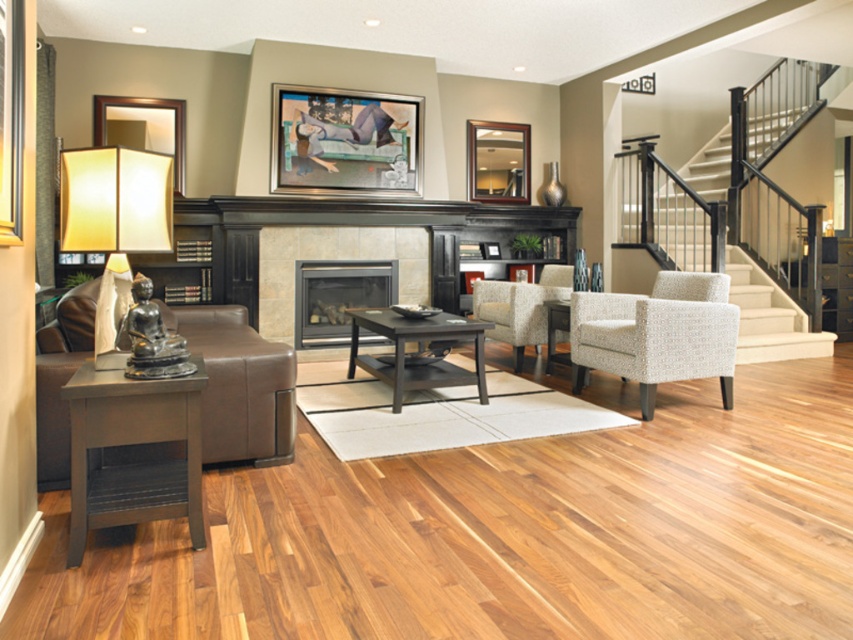
You are planning to place a new decorative item in the living room. The item you have is larger than the matte yellow fabric lampshade at left but smaller than the white textured stair at upper right. Where in the room would be a suitable location for this new item?

The new item should be placed near the matte yellow fabric lampshade at left since it is smaller than the white textured stair at upper right, ensuring it fits appropriately in the space.

You are arranging a shelf in the living room and need to place both the metallic silver picture frame at upper center and the wooden mirror at upper center. Since you want them side by side without overlapping, which object should you place first to ensure they fit properly?

The metallic silver picture frame at upper center should be placed first because its width is greater than the wooden mirror at upper center, ensuring there is enough space for both when placed side by side.

You are arranging a shelf in the living room and want to place both the metallic silver picture frame at upper center and the wooden mirror at upper center. Since you want to ensure stability, which object should you place at the bottom to prevent tipping?

The metallic silver picture frame at upper center is taller than the wooden mirror at upper center, so placing the metallic silver picture frame at upper center at the bottom would provide better stability due to its height.